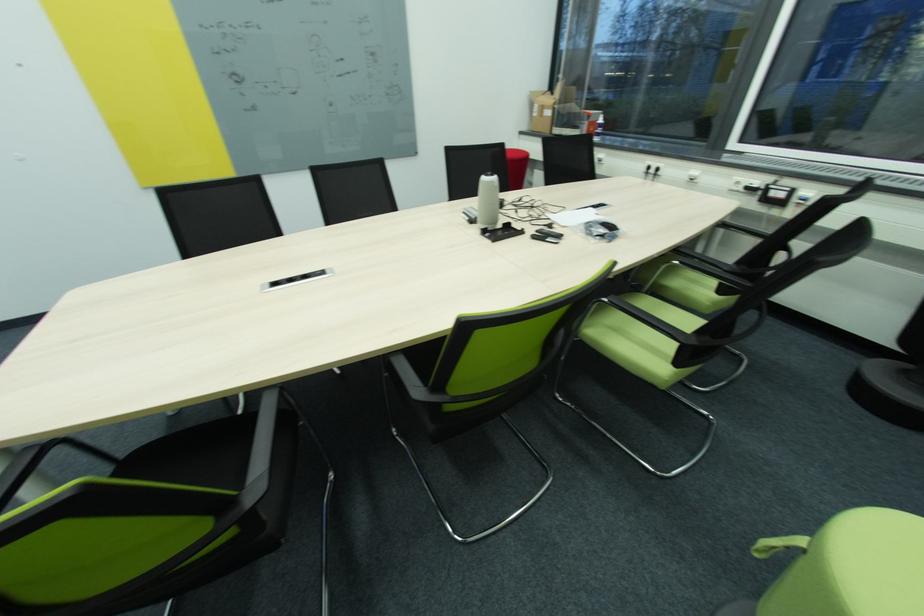
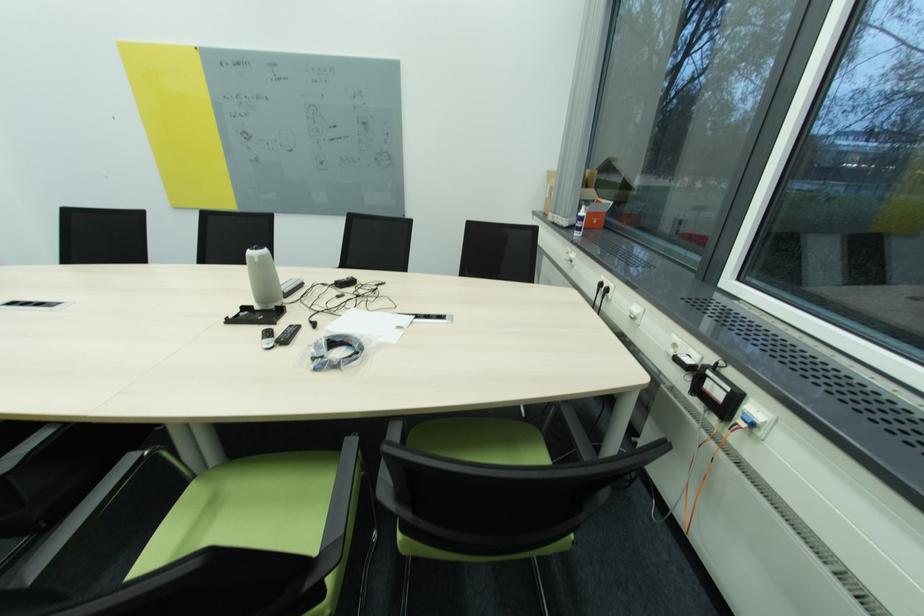
In the second image, find the point that corresponds to (541,232) in the first image.

(296, 328)